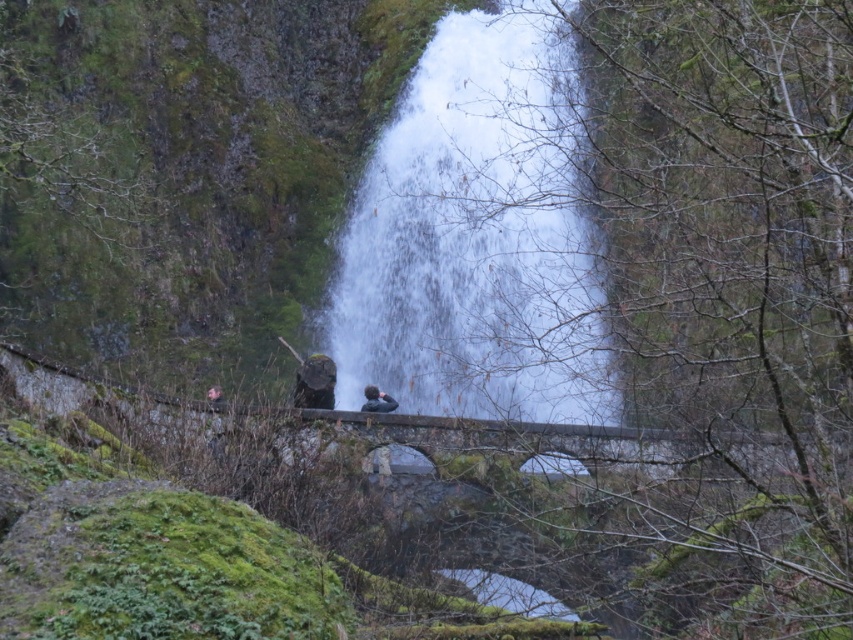
You are standing on the stone bridge and want to take a photo of the white frothy water at center. According to the scene description, where should you aim your camera to capture it?

You should aim your camera at point (466, 244) to capture the white frothy water at center.

Looking at this image, you are a hiker who wants to take a photo of the white frothy water at center from the stone bridge. The brown leather jacket at lower left is your backpack. Can you safely place your backpack on the bridge near the edge without it falling into the water?

The distance between the white frothy water at center and the brown leather jacket at lower left is 11.82 meters. Since the backpack is 11.82 meters away from the waterfall, it can be safely placed on the bridge near the edge without falling into the water.